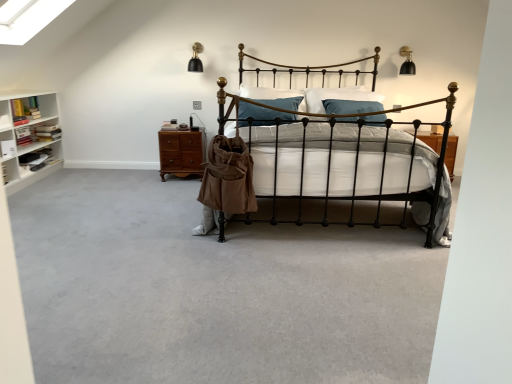
Question: Does gray carpet at center contain tan canvas bag at center?

Choices:
 (A) yes
 (B) no

Answer: (B)

Question: Is the position of gray carpet at center less distant than that of tan canvas bag at center?

Choices:
 (A) yes
 (B) no

Answer: (A)

Question: Is gray carpet at center aimed at tan canvas bag at center?

Choices:
 (A) yes
 (B) no

Answer: (B)

Question: Considering the relative sizes of gray carpet at center and tan canvas bag at center in the image provided, is gray carpet at center smaller than tan canvas bag at center?

Choices:
 (A) yes
 (B) no

Answer: (B)

Question: Can you confirm if gray carpet at center is positioned to the left of tan canvas bag at center?

Choices:
 (A) yes
 (B) no

Answer: (B)

Question: Choose the correct answer: Is tan canvas bag at center inside brown wood drawer at center or outside it?

Choices:
 (A) outside
 (B) inside

Answer: (A)

Question: Is tan canvas bag at center to the left or to the right of brown wood drawer at center in the image?

Choices:
 (A) right
 (B) left

Answer: (A)

Question: Looking at their shapes, would you say tan canvas bag at center is wider or thinner than brown wood drawer at center?

Choices:
 (A) wide
 (B) thin

Answer: (B)

Question: Is point (227, 170) closer or farther from the camera than point (164, 148)?

Choices:
 (A) closer
 (B) farther

Answer: (A)

Question: From a real-world perspective, is gray carpet at center physically located above or below black wrought iron bed at center?

Choices:
 (A) below
 (B) above

Answer: (A)

Question: Considering the relative positions of gray carpet at center and black wrought iron bed at center in the image provided, is gray carpet at center to the left or to the right of black wrought iron bed at center?

Choices:
 (A) right
 (B) left

Answer: (B)

Question: From their relative heights in the image, would you say gray carpet at center is taller or shorter than black wrought iron bed at center?

Choices:
 (A) tall
 (B) short

Answer: (B)

Question: From the image's perspective, is gray carpet at center above or below black wrought iron bed at center?

Choices:
 (A) above
 (B) below

Answer: (B)

Question: Considering the positions of point (155, 231) and point (176, 135), is point (155, 231) closer or farther from the camera than point (176, 135)?

Choices:
 (A) farther
 (B) closer

Answer: (B)

Question: Relative to brown wood drawer at center, is gray carpet at center in front or behind?

Choices:
 (A) behind
 (B) front

Answer: (B)